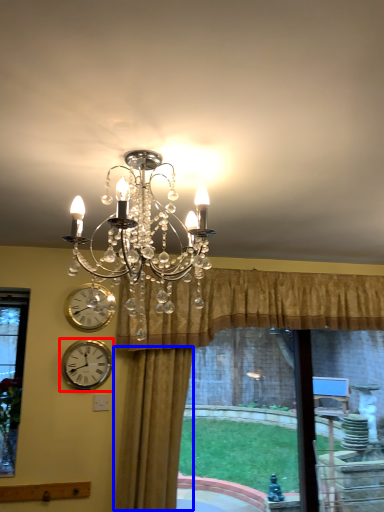
Question: Which object appears farthest to the camera in this image, wall clock (highlighted by a red box) or curtain (highlighted by a blue box)?

Choices:
 (A) wall clock
 (B) curtain

Answer: (A)